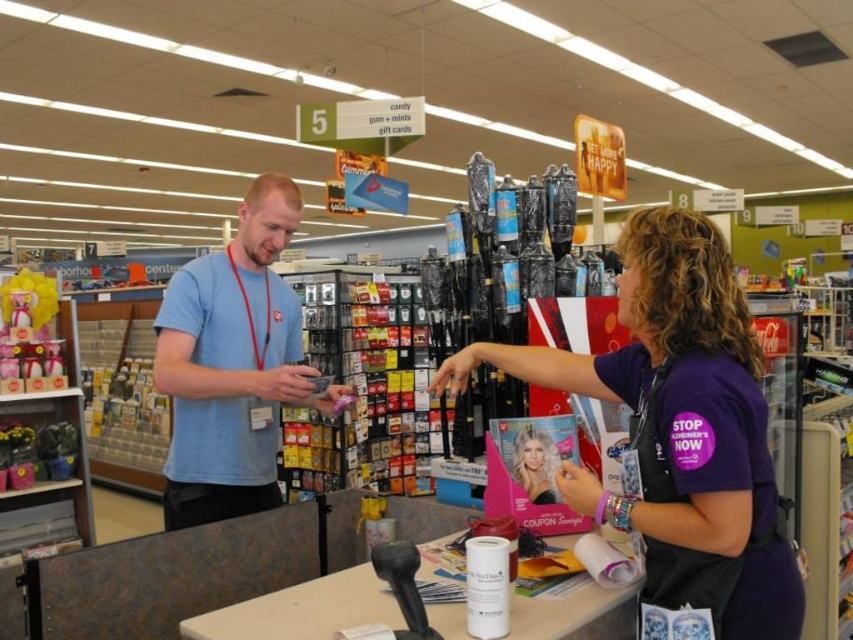
Who is taller, purple fabric shirt at center or light blue t-shirt at center?

light blue t-shirt at center is taller.

Is purple fabric shirt at center to the left of light blue t-shirt at center from the viewer's perspective?

In fact, purple fabric shirt at center is to the right of light blue t-shirt at center.

Between point (688, 476) and point (206, 436), which one is positioned behind?

Positioned behind is point (206, 436).

You are a GUI agent. You are given a task and a screenshot of the screen. Output one action in this format:
    pyautogui.click(x=<x>, y=<y>)
    Task: Click on the purple fabric shirt at center
    Image resolution: width=853 pixels, height=640 pixels.
    Given the screenshot: What is the action you would take?
    pyautogui.click(x=679, y=429)